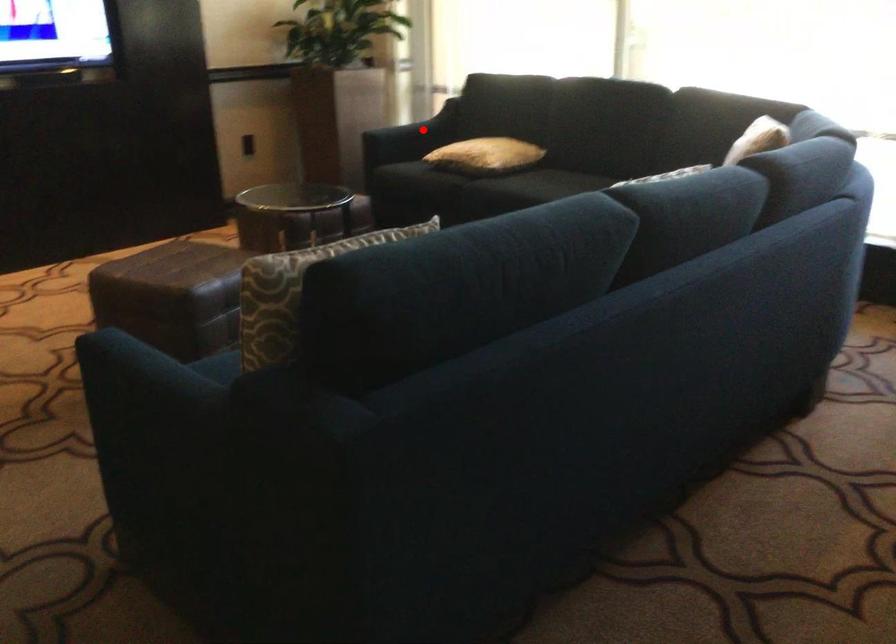
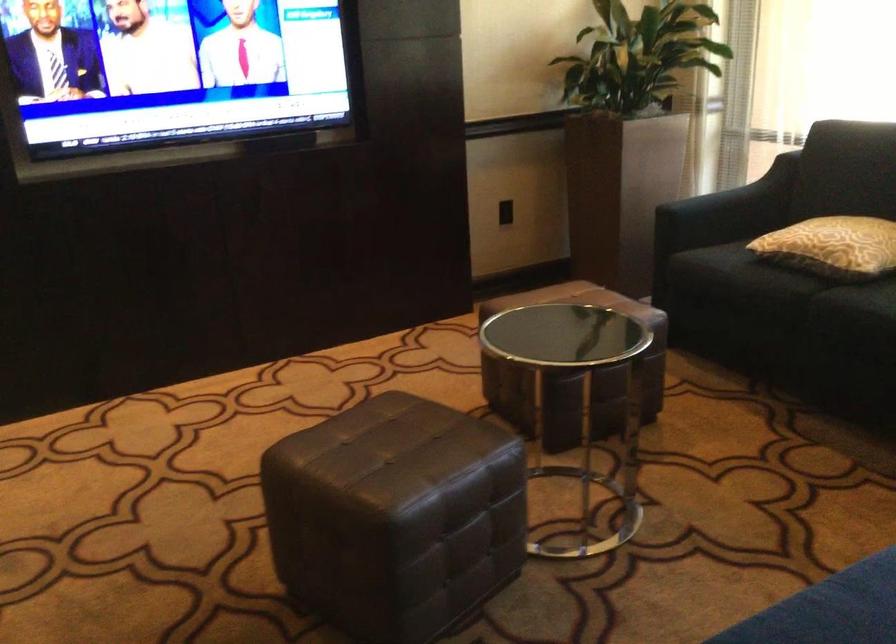
In the second image, find the point that corresponds to the highlighted location in the first image.

(742, 196)